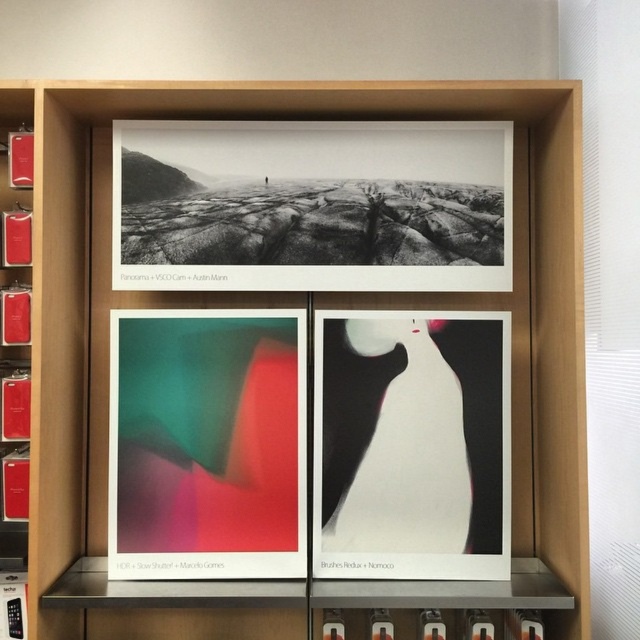
You are an interior designer trying to hang a new 10 inch wide decorative item between the black matte print at upper center and the matte plastic poster at center. Based on the spacing between them, will there be enough space for the item?

The distance between the black matte print at upper center and the matte plastic poster at center is 12.35 inches. Since the decorative item is 10 inches wide, there is sufficient space as 10 inches is less than 12.35 inches.

Based on the photo, you are standing in front of the wooden shelving unit and want to place a small decorative item on the closest object to you. Which object should you choose between the matte plastic poster at center and the white glossy vase at center?

The matte plastic poster at center is closer to the viewer than the white glossy vase at center, so you should place the decorative item on the matte plastic poster at center.

You are an art curator planning to hang two new paintings in the gallery. The first painting is to be placed at point (131, 193) and the second at point (353, 570). According to the existing shelving unit layout, which painting will be more visible to visitors entering the gallery from the front?

The painting placed at point (353, 570) will be more visible because point (131, 193) is behind point (353, 570), so it will be partially or fully obscured.